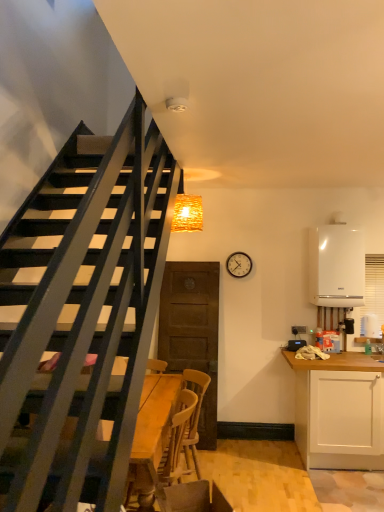
Question: Is wooden swivel chair at lower center not near white matte cabinet at right?

Choices:
 (A) yes
 (B) no

Answer: (A)

Question: Does wooden swivel chair at lower center lie in front of white matte cabinet at right?

Choices:
 (A) yes
 (B) no

Answer: (A)

Question: From a real-world perspective, is wooden swivel chair at lower center positioned under white matte cabinet at right based on gravity?

Choices:
 (A) yes
 (B) no

Answer: (A)

Question: Is wooden swivel chair at lower center outside white matte cabinet at right?

Choices:
 (A) no
 (B) yes

Answer: (B)

Question: Considering the relative positions of wooden swivel chair at lower center and white matte cabinet at right in the image provided, is wooden swivel chair at lower center to the right of white matte cabinet at right from the viewer's perspective?

Choices:
 (A) no
 (B) yes

Answer: (A)

Question: Can you confirm if wooden swivel chair at lower center is smaller than white matte cabinet at right?

Choices:
 (A) no
 (B) yes

Answer: (B)

Question: Is metallic round clock at upper right turned away from white glossy boiler at right?

Choices:
 (A) yes
 (B) no

Answer: (B)

Question: Can you confirm if metallic round clock at upper right is smaller than white glossy boiler at right?

Choices:
 (A) no
 (B) yes

Answer: (B)

Question: Is the depth of metallic round clock at upper right greater than that of white glossy boiler at right?

Choices:
 (A) yes
 (B) no

Answer: (A)

Question: Is metallic round clock at upper right shorter than white glossy boiler at right?

Choices:
 (A) no
 (B) yes

Answer: (B)

Question: Is metallic round clock at upper right to the right of white glossy boiler at right from the viewer's perspective?

Choices:
 (A) no
 (B) yes

Answer: (A)

Question: Can you confirm if metallic round clock at upper right is bigger than white glossy boiler at right?

Choices:
 (A) no
 (B) yes

Answer: (A)

Question: From a real-world perspective, is woven wood light fixture at upper center under metallic round clock at upper right?

Choices:
 (A) no
 (B) yes

Answer: (A)